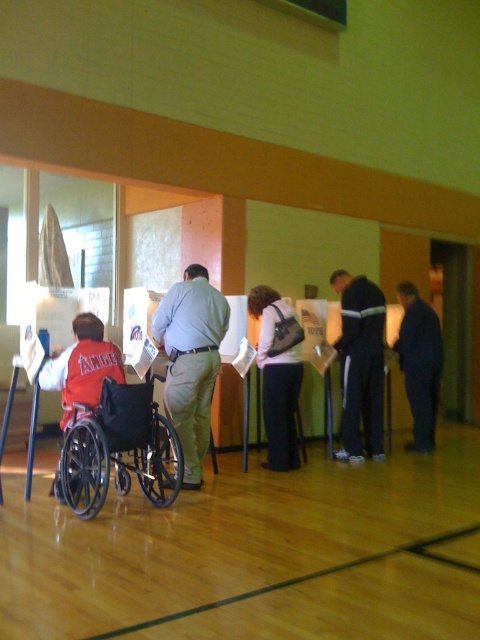
Can you confirm if dark gray tracksuit at center is positioned to the right of dark gray fabric jacket at center?

Indeed, dark gray tracksuit at center is positioned on the right side of dark gray fabric jacket at center.

Is point (367, 429) farther from camera compared to point (262, 369)?

Yes, it is behind point (262, 369).

Between point (367, 378) and point (264, 285), which one is positioned in front?

Positioned in front is point (264, 285).

Identify the location of dark gray tracksuit at center. The height and width of the screenshot is (640, 480). (360, 364).

Is dark gray tracksuit at center shorter than red fleece jacket at left?

No, dark gray tracksuit at center is not shorter than red fleece jacket at left.

Describe the element at coordinates (360, 364) in the screenshot. I see `dark gray tracksuit at center` at that location.

I want to click on dark gray tracksuit at center, so click(360, 364).

Between black matte wheelchair at left and dark blue jeans at center, which one has less height?

black matte wheelchair at left

Is point (156, 506) behind point (424, 451)?

No, (156, 506) is closer to viewer.

You are a GUI agent. You are given a task and a screenshot of the screen. Output one action in this format:
    pyautogui.click(x=<x>, y=<y>)
    Task: Click on the black matte wheelchair at left
    The height and width of the screenshot is (640, 480).
    Given the screenshot: What is the action you would take?
    pyautogui.click(x=119, y=449)